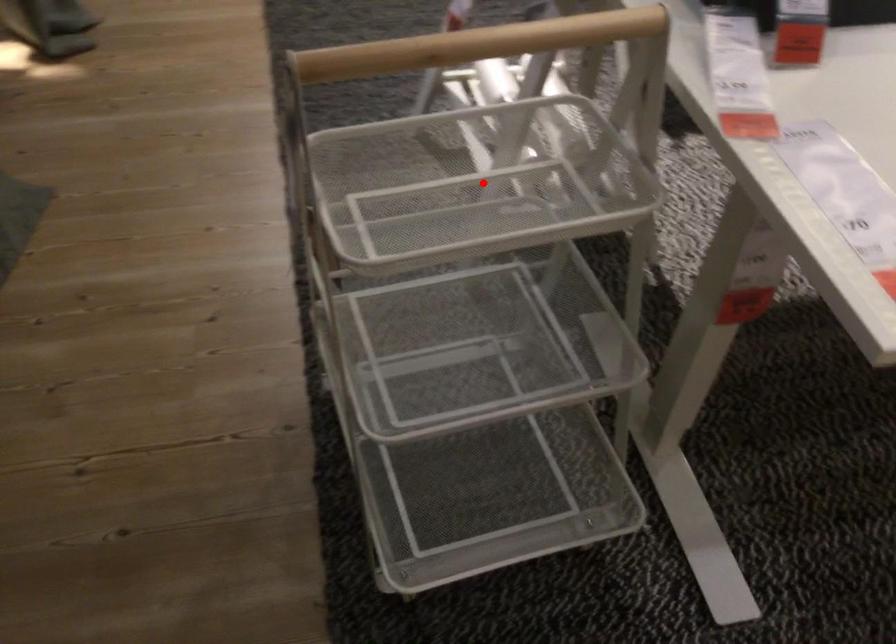
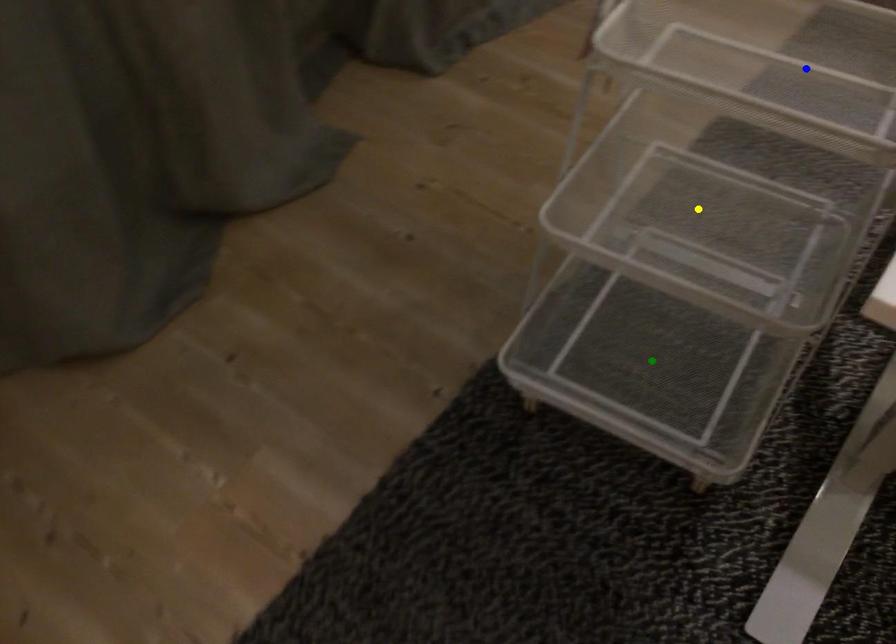
Question: I am providing you with two images of the same scene from different viewpoints. A red point is marked on the first image. You are given multiple points on the second image. In image 2, which mark is for the same physical point as the one in image 1?

Choices:
 (A) blue point
 (B) yellow point
 (C) green point

Answer: (A)